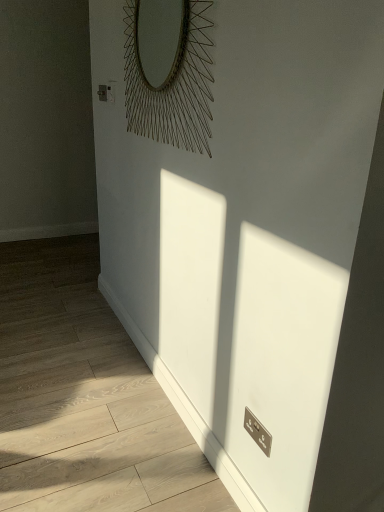
Question: Considering the positions of white glossy radiator at lower right and metallic wire at upper center in the image, is white glossy radiator at lower right taller or shorter than metallic wire at upper center?

Choices:
 (A) tall
 (B) short

Answer: (B)

Question: Is point (79, 276) positioned closer to the camera than point (130, 67)?

Choices:
 (A) farther
 (B) closer

Answer: (A)

Question: From the image's perspective, is white glossy radiator at lower right positioned above or below metallic wire at upper center?

Choices:
 (A) above
 (B) below

Answer: (B)

Question: Considering the positions of metallic wire at upper center and white glossy radiator at lower right in the image, is metallic wire at upper center taller or shorter than white glossy radiator at lower right?

Choices:
 (A) short
 (B) tall

Answer: (B)

Question: Would you say metallic wire at upper center is to the left or to the right of white glossy radiator at lower right in the picture?

Choices:
 (A) left
 (B) right

Answer: (B)

Question: From a real-world perspective, relative to white glossy radiator at lower right, is metallic wire at upper center vertically above or below?

Choices:
 (A) below
 (B) above

Answer: (B)

Question: From the image's perspective, is metallic wire at upper center positioned above or below white glossy radiator at lower right?

Choices:
 (A) above
 (B) below

Answer: (A)